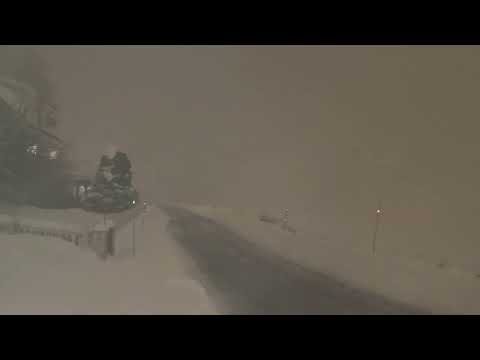
You are a GUI agent. You are given a task and a screenshot of the screen. Output one action in this format:
    pyautogui.click(x=<x>, y=<y>)
    Task: Click on the light
    
    Given the screenshot: What is the action you would take?
    pyautogui.click(x=378, y=212)